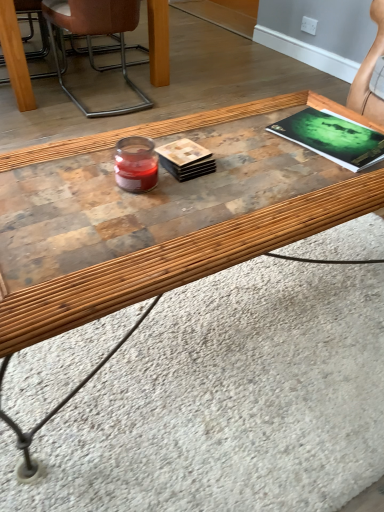
Where is `vacant space situated above green matte magazine at upper right (from a real-world perspective)`? The image size is (384, 512). vacant space situated above green matte magazine at upper right (from a real-world perspective) is located at coordinates (332, 131).